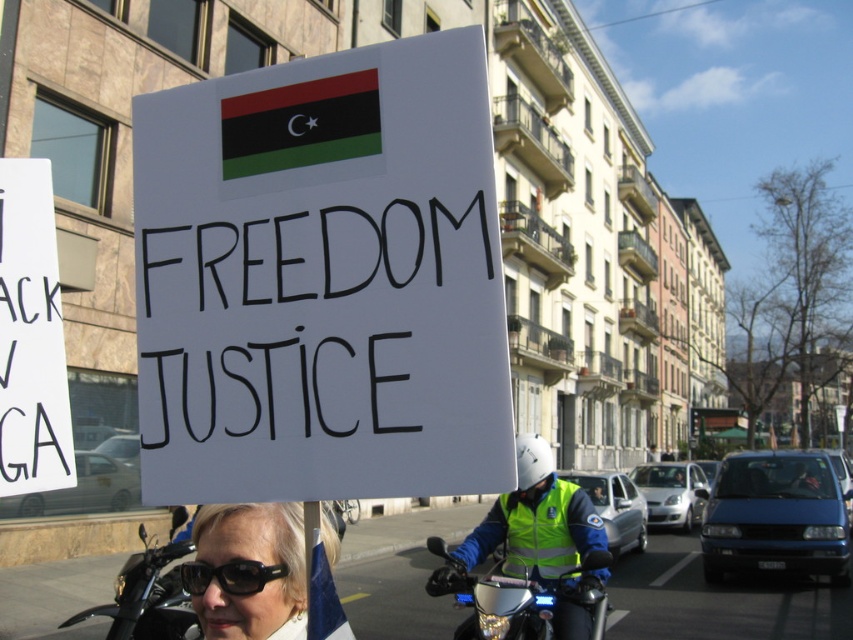
Question: In this image, where is white paper sign at center located relative to matte black sunglasses at lower left?

Choices:
 (A) below
 (B) above

Answer: (B)

Question: Which is farther from the white paper sign at center?

Choices:
 (A) high-visibility reflective vest at center
 (B) metallic silver motorcycle at center
 (C) black reflective sunglasses at center

Answer: (B)

Question: Which is nearer to the white paper sign at center?

Choices:
 (A) high-visibility reflective vest at center
 (B) black glossy motorcycle at lower left
 (C) black reflective sunglasses at center

Answer: (C)

Question: Which of the following is the farthest from the observer?

Choices:
 (A) metallic silver motorcycle at center
 (B) matte black sunglasses at lower left
 (C) high-visibility reflective vest at center
 (D) white paper sign at center

Answer: (A)

Question: Does white paper sign at center have a larger size compared to matte black sunglasses at lower left?

Choices:
 (A) no
 (B) yes

Answer: (B)

Question: Can you confirm if high-visibility reflective vest at center is wider than matte black sunglasses at lower left?

Choices:
 (A) no
 (B) yes

Answer: (A)